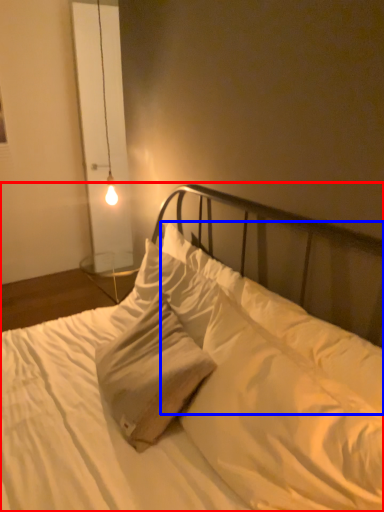
Question: Among these objects, which one is farthest to the camera, bed (highlighted by a red box) or pillow (highlighted by a blue box)?

Choices:
 (A) bed
 (B) pillow

Answer: (B)